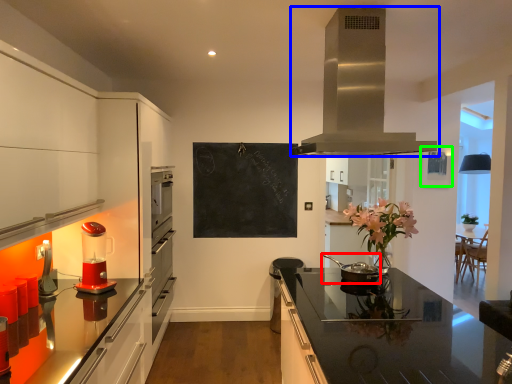
Question: Which is farther away from kitchen appliance (highlighted by a red box)? home appliance (highlighted by a blue box) or picture frame (highlighted by a green box)?

Choices:
 (A) home appliance
 (B) picture frame

Answer: (B)